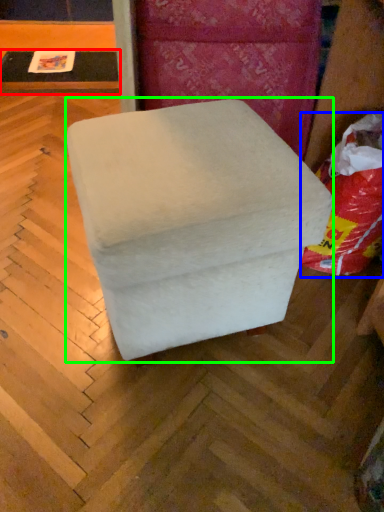
Question: Based on their relative distances, which object is farther from table (highlighted by a red box)? Choose from bean bag chair (highlighted by a blue box) and furniture (highlighted by a green box).

Choices:
 (A) bean bag chair
 (B) furniture

Answer: (B)